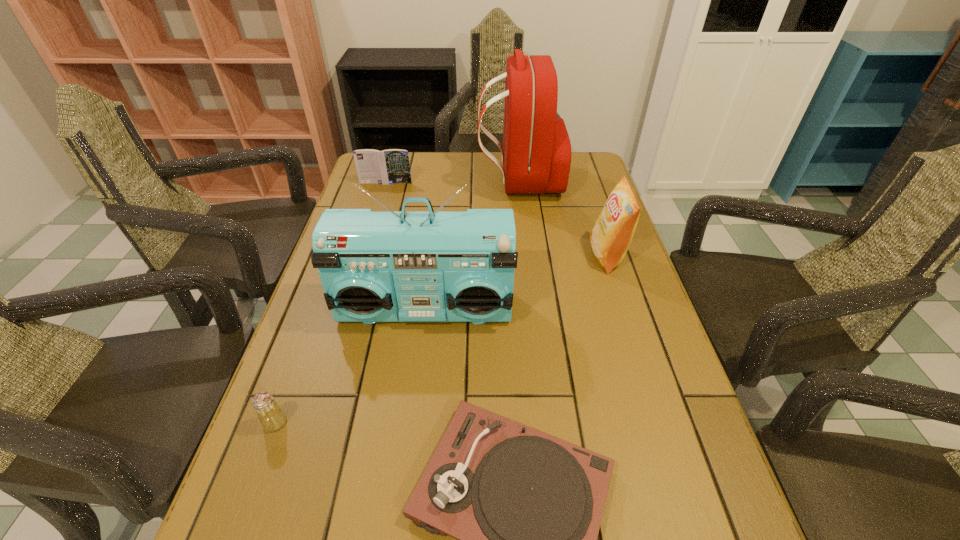
Identify which object is located as the second nearest to the phonograph_record. Please provide its 2D coordinates. Your answer should be formatted as a tuple, i.e. [(x, y)], where the tuple contains the x and y coordinates of a point satisfying the conditions above.

[(271, 416)]

Select which object appears as the third closest to the tallest object. Please provide its 2D coordinates. Your answer should be formatted as a tuple, i.e. [(x, y)], where the tuple contains the x and y coordinates of a point satisfying the conditions above.

[(429, 266)]

This screenshot has width=960, height=540. In order to click on blank space that satisfies the following two spatial constraints: 1. on the strap side of the tallest object; 2. on the front side of the saltshaker in this screenshot , I will do `click(549, 422)`.

Where is `free spot that satisfies the following two spatial constraints: 1. on the strap side of the backpack; 2. on the front-facing side of the third nearest object`? Image resolution: width=960 pixels, height=540 pixels. free spot that satisfies the following two spatial constraints: 1. on the strap side of the backpack; 2. on the front-facing side of the third nearest object is located at coordinates (535, 309).